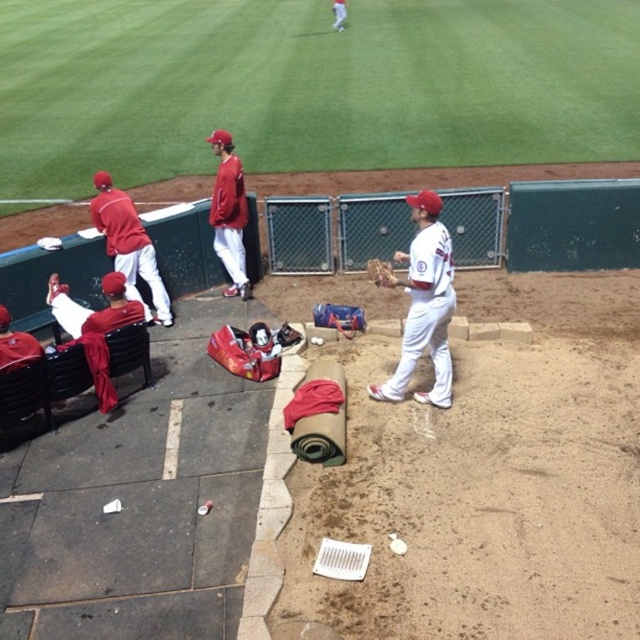
Question: Considering the relative positions of matte red uniform at center and white matte baseball cap at left in the image provided, where is matte red uniform at center located with respect to white matte baseball cap at left?

Choices:
 (A) left
 (B) right

Answer: (B)

Question: Does white matte uniform at center appear on the left side of matte red uniform at center?

Choices:
 (A) no
 (B) yes

Answer: (A)

Question: Which point is farther from the camera taking this photo?

Choices:
 (A) (97, 186)
 (B) (374, 280)
 (C) (339, 6)

Answer: (C)

Question: Which point appears closest to the camera in this image?

Choices:
 (A) (19, 333)
 (B) (403, 385)
 (C) (241, 196)

Answer: (A)

Question: Estimate the real-world distances between objects in this image. Which object is closer to the matte red uniform at left?

Choices:
 (A) matte red uniform at center
 (B) white matte uniform at center

Answer: (A)

Question: Is green grass at upper center to the left of matte red uniform at center from the viewer's perspective?

Choices:
 (A) yes
 (B) no

Answer: (B)